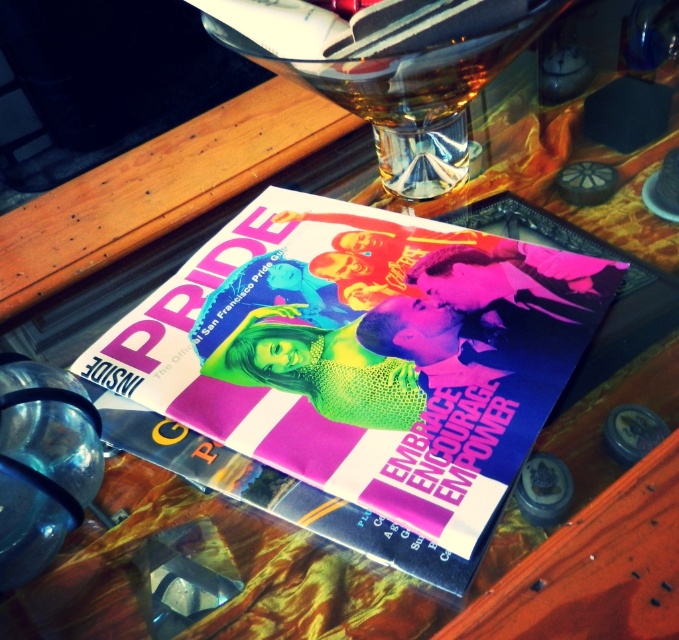
Does vibrant glossy magazine at center appear on the right side of transparent plastic bottle at lower left?

Correct, you'll find vibrant glossy magazine at center to the right of transparent plastic bottle at lower left.

Which is behind, point (551, 380) or point (43, 380)?

Point (551, 380)

This screenshot has height=640, width=679. I want to click on vibrant glossy magazine at center, so click(365, 355).